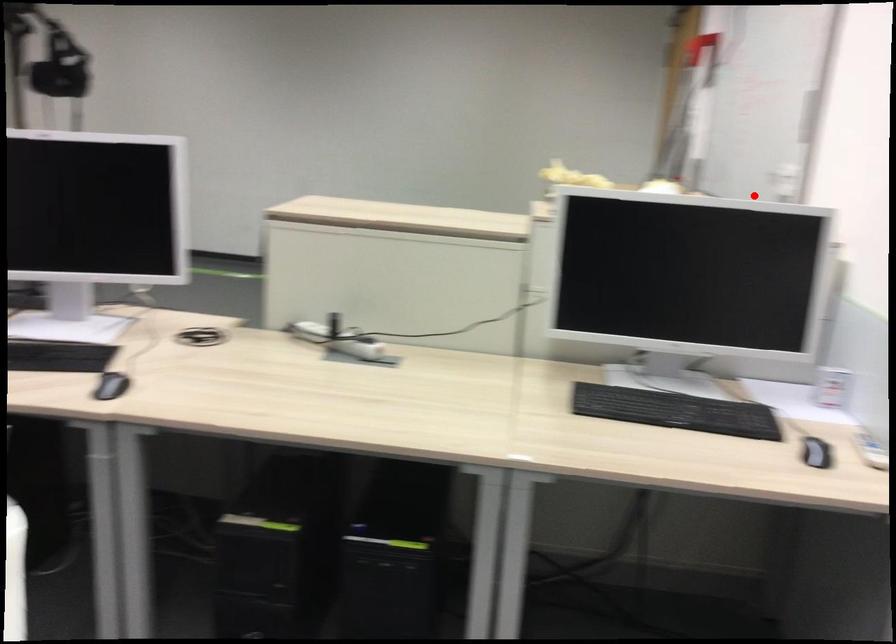
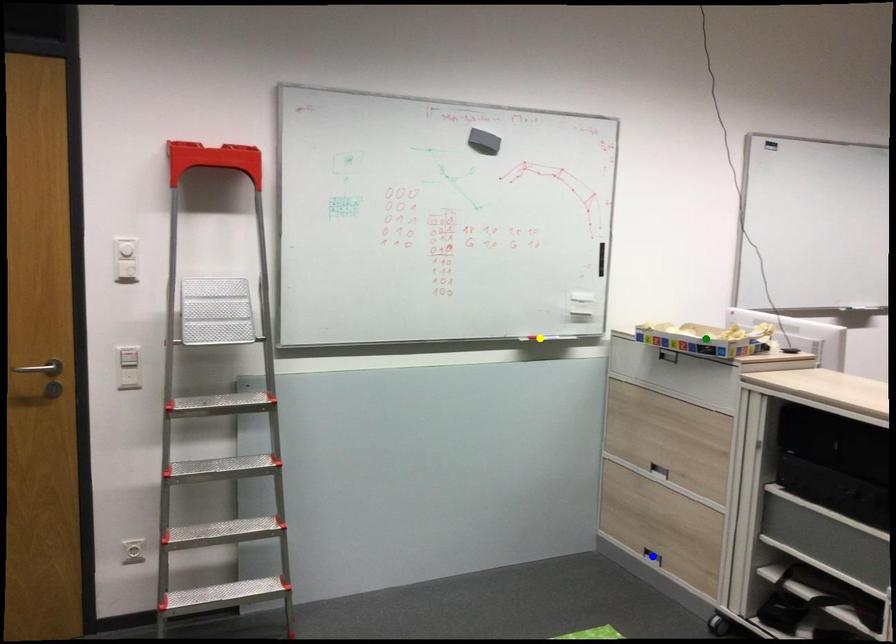
Question: I am providing you with two images of the same scene from different viewpoints. A red point is marked on the first image. You are given multiple points on the second image. Can you choose the point in image 2 that corresponds to the point in image 1?

Choices:
 (A) yellow point
 (B) blue point
 (C) green point

Answer: (A)